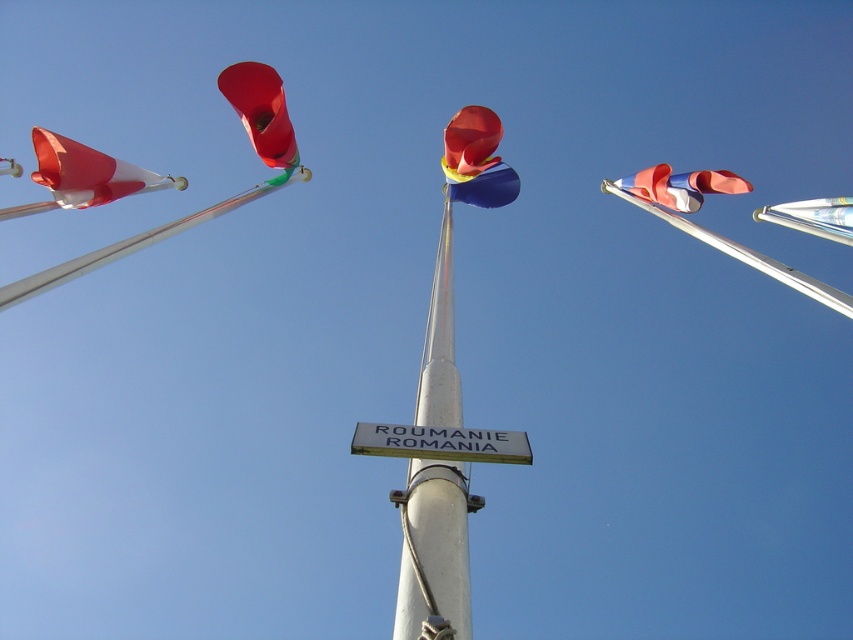
You are a photographer planning to capture both the white fabric flag at left and the matte white flag at right in a single shot. Given their sizes, which flag should you focus on first to ensure both are visible in the frame?

The white fabric flag at left is bigger than the matte white flag at right, so you should focus on the white fabric flag at left first to ensure both fit within the frame.

You are standing at the base of the flagpoles and want to take a photo of the white fabric flag at left without the matte white flag at right appearing in the background. Is this possible given their positions?

Yes, since the white fabric flag at left is in front of the matte white flag at right, you can position yourself so that the white fabric flag at left blocks the view of the matte white flag at right, ensuring it doesn not appear in the photo.

From the picture: You are a maintenance worker needing to reach both the silver metallic pole at center and the white fabric flag at left. Your ladder can extend up to 20 feet. Can you safely reach both objects with your current ladder?

The distance between the silver metallic pole at center and the white fabric flag at left is 23.07 feet, which exceeds the ladder extension limit of 20 feet. Therefore, you cannot safely reach both objects with your current ladder.